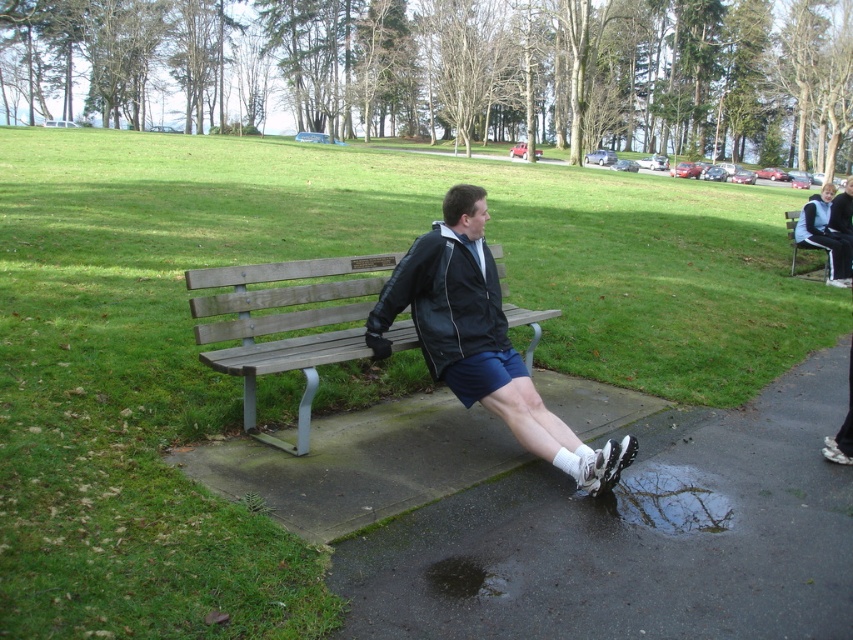
You are a photographer planning to take a portrait of the man in the park. You need to ensure that both the black leather jacket at center and the wooden bench at center are visible in the frame. Given their sizes, which object should you focus on to ensure both are in the frame without cropping?

Since the black leather jacket at center is smaller than the wooden bench at center, you should focus on the wooden bench at center to ensure both objects fit within the frame.